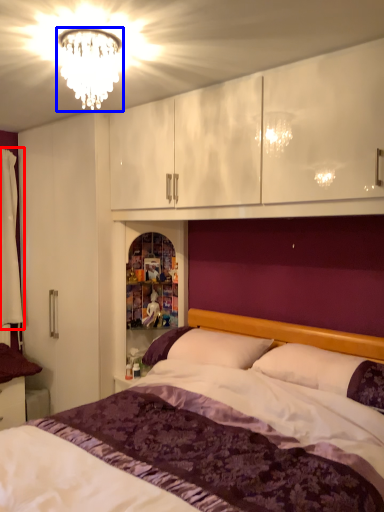
Question: Which object appears closest to the camera in this image, curtain (highlighted by a red box) or fixture (highlighted by a blue box)?

Choices:
 (A) curtain
 (B) fixture

Answer: (B)